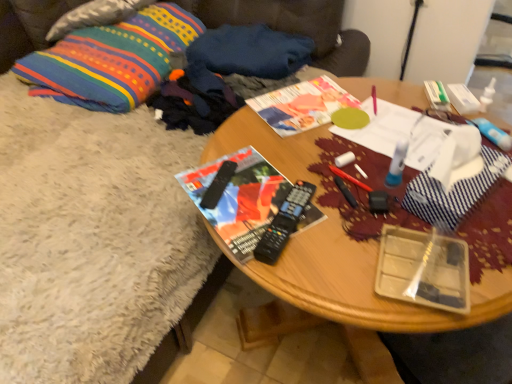
Where is `blank space above matte black magazine at center (from a real-world perspective)`? blank space above matte black magazine at center (from a real-world perspective) is located at coordinates (247, 192).